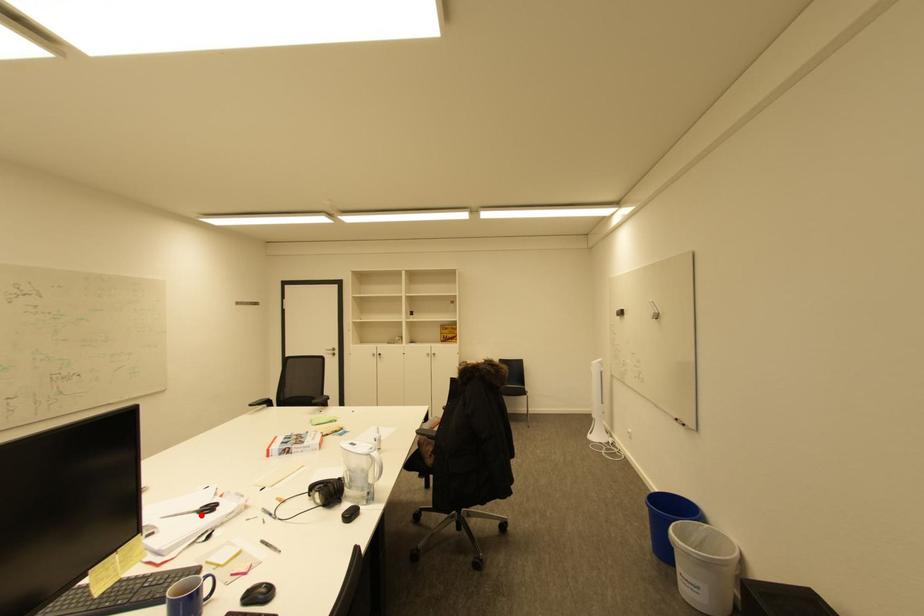
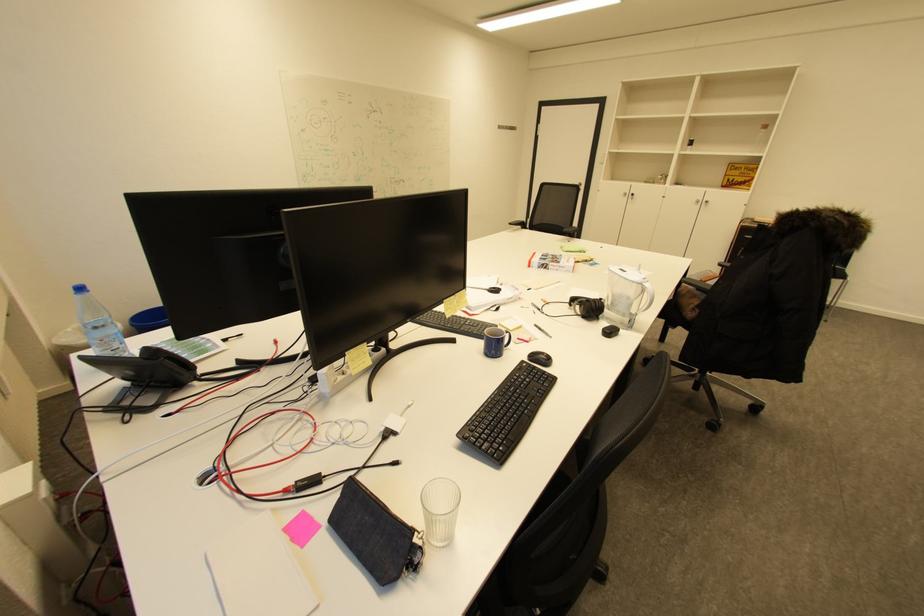
Locate, in the second image, the point that corresponds to the highlighted location in the first image.

(492, 292)